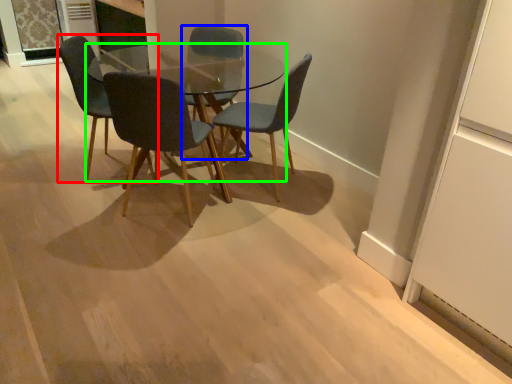
Question: Which object is the closest to the chair (highlighted by a red box)? Choose among these: chair (highlighted by a blue box) or coffee table (highlighted by a green box).

Choices:
 (A) chair
 (B) coffee table

Answer: (A)